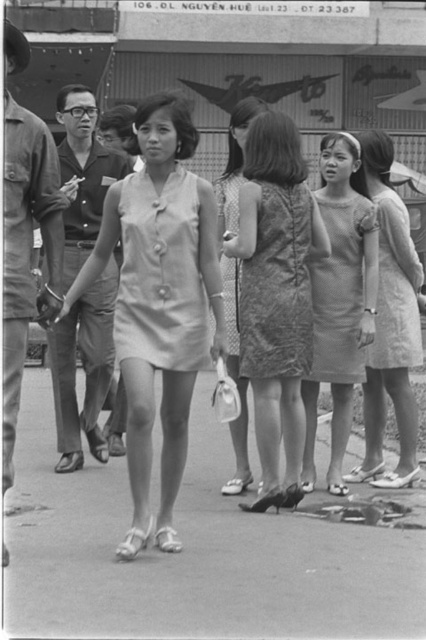
Question: Is smooth concrete pavement at center below light beige fabric dress at center?

Choices:
 (A) no
 (B) yes

Answer: (B)

Question: Which object is positioned farthest from the dotted fabric dress at center?

Choices:
 (A) satin textured dress at center
 (B) lace dress at center
 (C) light beige fabric dress at center
 (D) patterned fabric dress at center

Answer: (C)

Question: Is patterned fabric dress at center in front of smooth gray dress at center?

Choices:
 (A) no
 (B) yes

Answer: (B)

Question: Is dotted fabric dress at center to the right of patterned fabric dress at center from the viewer's perspective?

Choices:
 (A) no
 (B) yes

Answer: (B)

Question: Which of the following is the farthest from the observer?

Choices:
 (A) (374, 179)
 (B) (244, 452)
 (C) (298, 392)
 (D) (227, 291)

Answer: (A)

Question: Which object is positioned closest to the white textured dress at center?

Choices:
 (A) patterned fabric dress at center
 (B) smooth concrete pavement at center
 (C) light beige fabric dress at right

Answer: (C)